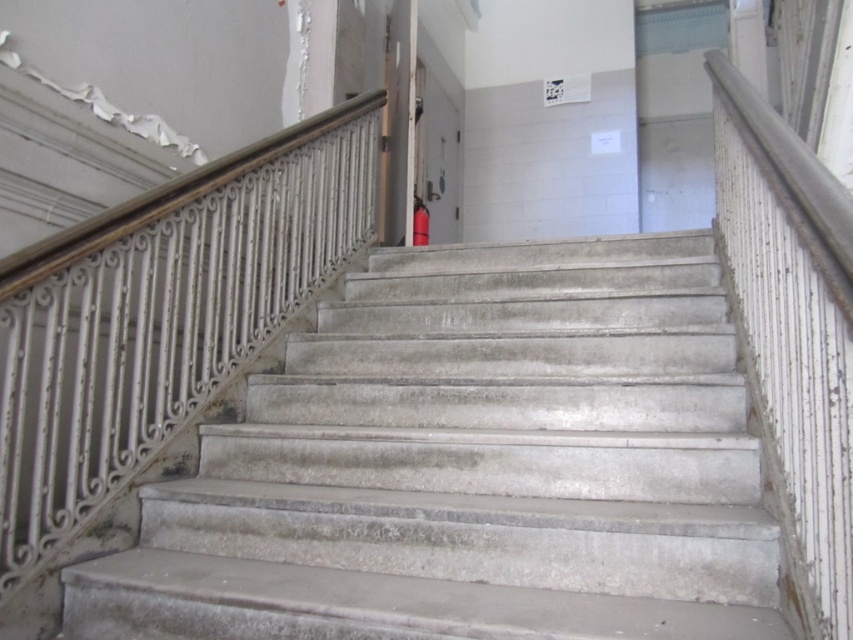
Does concrete stairs at center have a lesser width compared to white wrought iron at upper left?

In fact, concrete stairs at center might be wider than white wrought iron at upper left.

Can you confirm if concrete stairs at center is wider than white wrought iron at upper left?

Correct, the width of concrete stairs at center exceeds that of white wrought iron at upper left.

Is point (294, 356) farther from viewer compared to point (202, 352)?

Yes, it is behind point (202, 352).

Locate an element on the screen. This screenshot has width=853, height=640. concrete stairs at center is located at coordinates click(x=473, y=465).